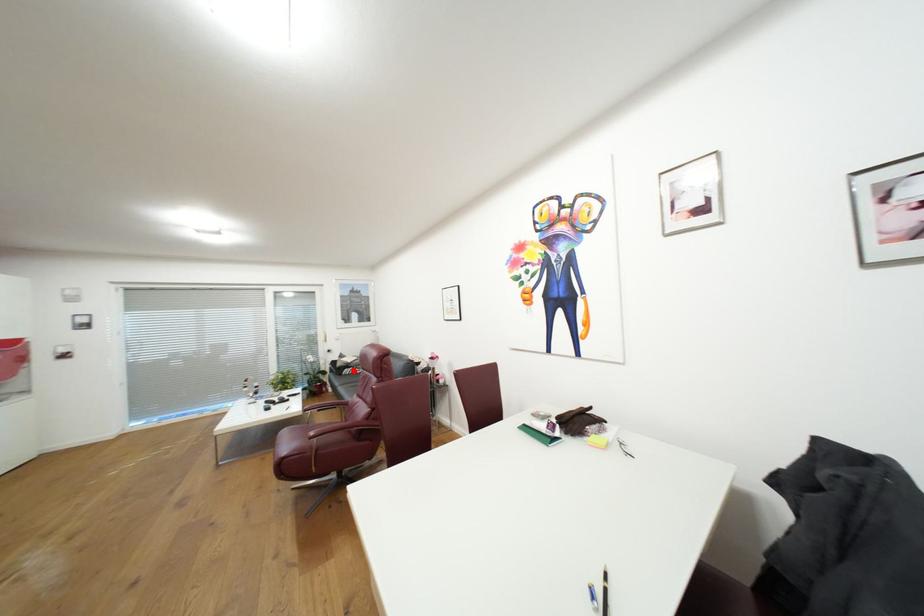
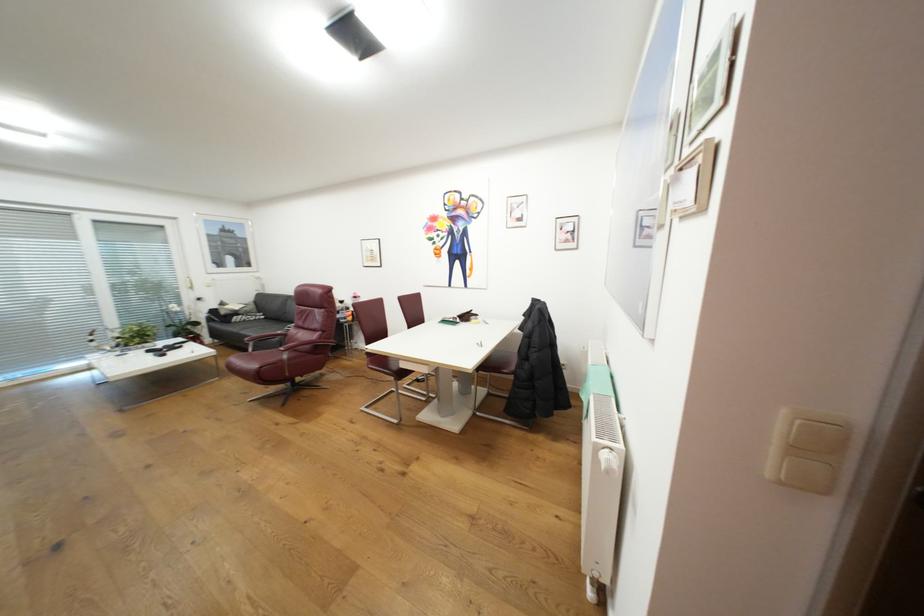
Question: I am providing you with two images of the same scene from different viewpoints. A red point is shown in image1. For the corresponding object point in image2, is it positioned nearer or farther from the camera?

Choices:
 (A) Nearer
 (B) Farther

Answer: (A)